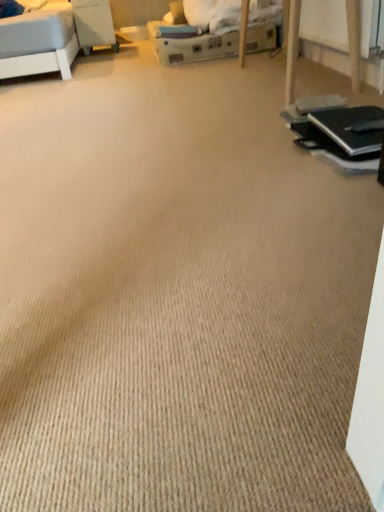
Where is `wooden table at upper left`? wooden table at upper left is located at coordinates (94, 24).

This screenshot has height=512, width=384. Describe the element at coordinates (94, 24) in the screenshot. I see `wooden table at upper left` at that location.

Image resolution: width=384 pixels, height=512 pixels. What do you see at coordinates (352, 128) in the screenshot?
I see `black matte laptop at right` at bounding box center [352, 128].

Identify the location of black matte laptop at right. (352, 128).

Identify the location of wooden table at upper left. The image size is (384, 512). (94, 24).

Which is more to the right, wooden table at upper left or black matte laptop at right?

From the viewer's perspective, black matte laptop at right appears more on the right side.

Is wooden table at upper left closer to camera compared to black matte laptop at right?

No, wooden table at upper left is further to the viewer.

Between point (114, 48) and point (335, 122), which one is positioned in front?

The point (335, 122) is closer.

From the image's perspective, does wooden table at upper left appear lower than black matte laptop at right?

Actually, wooden table at upper left appears above black matte laptop at right in the image.

From a real-world perspective, which object stands above the other?

In real-world perspective, wooden table at upper left is above.

Is wooden table at upper left wider than black matte laptop at right?

Correct, the width of wooden table at upper left exceeds that of black matte laptop at right.

Considering the sizes of objects wooden table at upper left and black matte laptop at right in the image provided, who is taller, wooden table at upper left or black matte laptop at right?

With more height is wooden table at upper left.

Considering the relative sizes of wooden table at upper left and black matte laptop at right in the image provided, is wooden table at upper left smaller than black matte laptop at right?

No.

Based on the photo, is wooden table at upper left located outside black matte laptop at right?

Yes.

Is the surface of wooden table at upper left in direct contact with black matte laptop at right?

No, wooden table at upper left is not making contact with black matte laptop at right.

Is wooden table at upper left turned away from black matte laptop at right?

wooden table at upper left does not have its back to black matte laptop at right.

How different are the orientations of wooden table at upper left and black matte laptop at right in degrees?

The angle between the facing direction of wooden table at upper left and the facing direction of black matte laptop at right is 89.1 degrees.

This screenshot has height=512, width=384. Identify the location of laptop below the wooden table at upper left (from the image's perspective). (352, 128).

Is black matte laptop at right to the right of wooden table at upper left from the viewer's perspective?

Correct, you'll find black matte laptop at right to the right of wooden table at upper left.

Is the position of black matte laptop at right more distant than that of wooden table at upper left?

That is False.

Is point (358, 133) closer to viewer compared to point (85, 19)?

Yes, it is in front of point (85, 19).

From the image's perspective, is black matte laptop at right positioned above or below wooden table at upper left?

black matte laptop at right is below wooden table at upper left.

From a real-world perspective, which is physically below, black matte laptop at right or wooden table at upper left?

From a 3D spatial view, black matte laptop at right is below.

Does black matte laptop at right have a greater width compared to wooden table at upper left?

No, black matte laptop at right is not wider than wooden table at upper left.

Which of these two, black matte laptop at right or wooden table at upper left, stands shorter?

black matte laptop at right.

Considering the sizes of black matte laptop at right and wooden table at upper left in the image, is black matte laptop at right bigger or smaller than wooden table at upper left?

Considering their sizes, black matte laptop at right takes up less space than wooden table at upper left.

Based on the photo, does black matte laptop at right contain wooden table at upper left?

Actually, wooden table at upper left is outside black matte laptop at right.

Are black matte laptop at right and wooden table at upper left located far from each other?

Indeed, black matte laptop at right is not near wooden table at upper left.

Is black matte laptop at right oriented away from wooden table at upper left?

No, wooden table at upper left is not at the back of black matte laptop at right.

How distant is black matte laptop at right from wooden table at upper left?

black matte laptop at right and wooden table at upper left are 10.99 feet apart from each other.

Identify the location of laptop lying in front of the wooden table at upper left. (352, 128).

At what (x,y) coordinates should I click in order to perform the action: click on laptop below the wooden table at upper left (from the image's perspective). Please return your answer as a coordinate pair (x, y). Image resolution: width=384 pixels, height=512 pixels. Looking at the image, I should click on tap(352, 128).

The height and width of the screenshot is (512, 384). In order to click on table on the left of black matte laptop at right in this screenshot , I will do (94, 24).